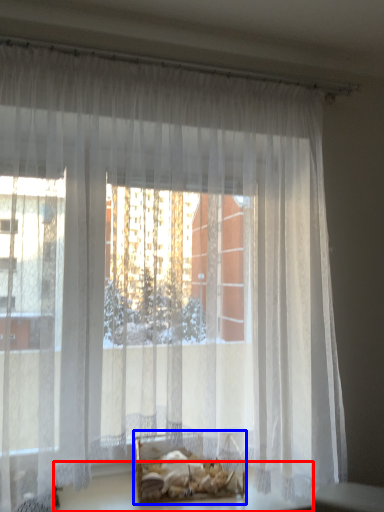
Question: Among these objects, which one is nearest to the camera, table (highlighted by a red box) or bed (highlighted by a blue box)?

Choices:
 (A) table
 (B) bed

Answer: (A)